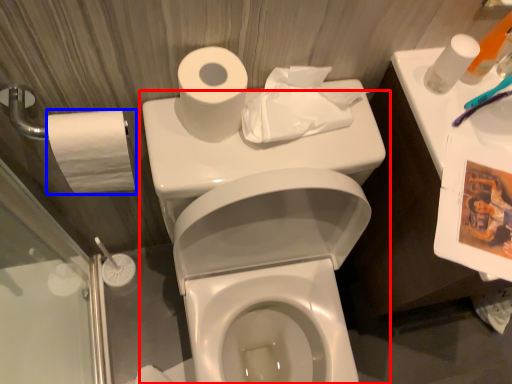
Question: Which object is further to the camera taking this photo, toilet (highlighted by a red box) or toilet paper (highlighted by a blue box)?

Choices:
 (A) toilet
 (B) toilet paper

Answer: (B)